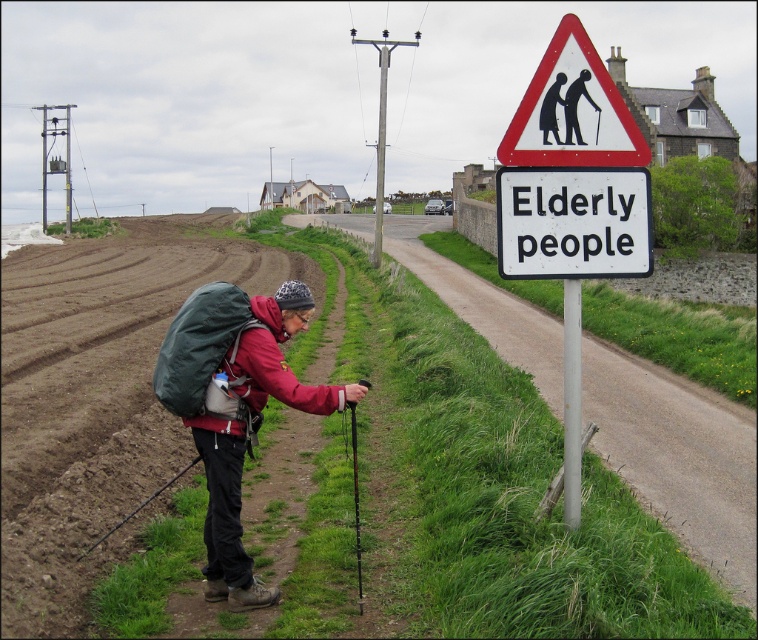
Question: Which object appears farthest from the camera in this image?

Choices:
 (A) metallic pole at right
 (B) white plastic elderly people sign at upper right
 (C) black fabric backpack at lower left

Answer: (A)

Question: Which point is farther to the camera?

Choices:
 (A) (581, 70)
 (B) (578, 49)

Answer: (A)

Question: Is black plastic cane at upper center to the right of black fabric backpack at lower left from the viewer's perspective?

Choices:
 (A) no
 (B) yes

Answer: (B)

Question: Does red fleece jacket at center have a larger size compared to metallic pole at right?

Choices:
 (A) no
 (B) yes

Answer: (B)

Question: Among these objects, which one is farthest from the camera?

Choices:
 (A) metallic pole at right
 (B) red triangle sign at upper center
 (C) red fleece jacket at center
 (D) black fabric backpack at lower left

Answer: (B)

Question: In this image, where is metallic pole at right located relative to black plastic cane at upper center?

Choices:
 (A) below
 (B) above

Answer: (A)